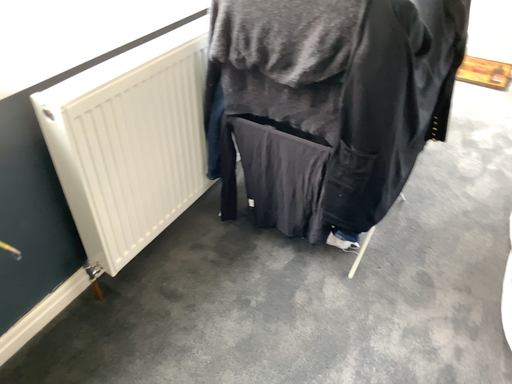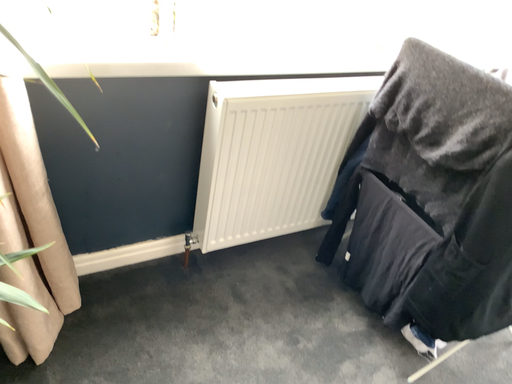
Question: Which way did the camera rotate in the video?

Choices:
 (A) rotated left
 (B) rotated right

Answer: (A)